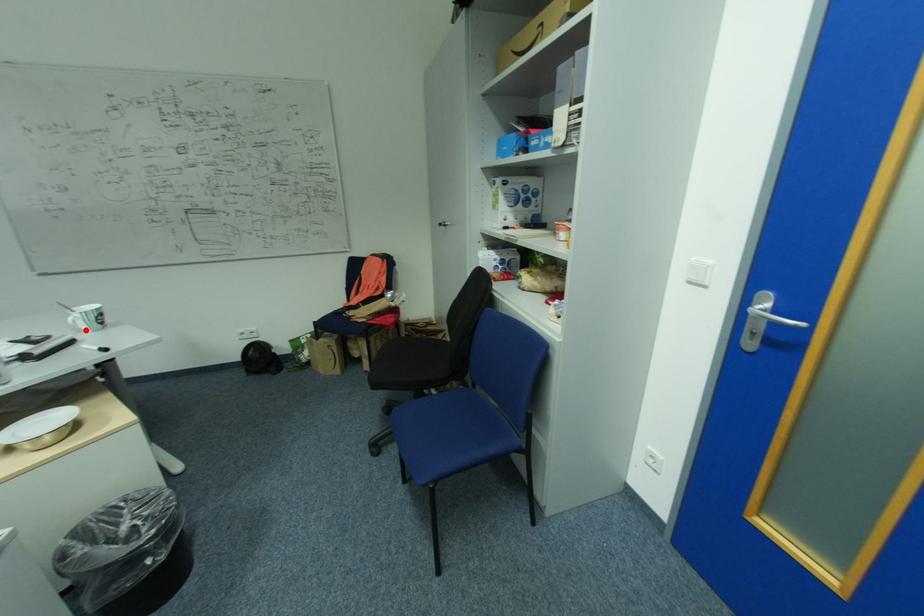
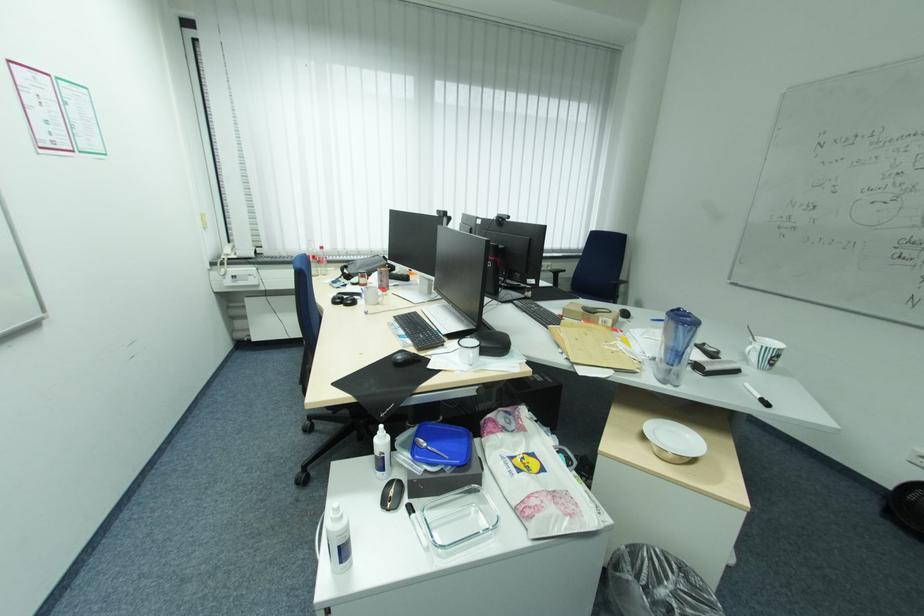
The point at the highlighted location is marked in the first image. Where is the corresponding point in the second image?

(752, 360)